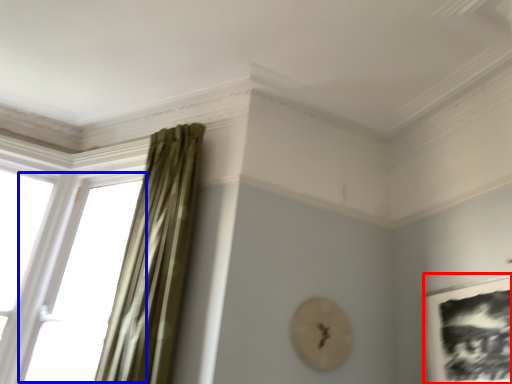
Question: Which point is closer to the camera, picture frame (highlighted by a red box) or window (highlighted by a blue box)?

Choices:
 (A) picture frame
 (B) window

Answer: (A)